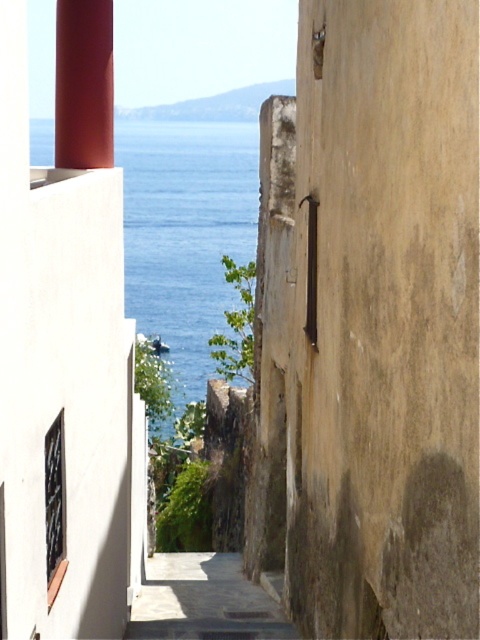
Question: Which of the following is the farthest from the observer?

Choices:
 (A) (287, 234)
 (B) (187, 218)

Answer: (B)

Question: Can you confirm if smooth concrete pillar at center is wider than blue water at center?

Choices:
 (A) yes
 (B) no

Answer: (B)

Question: Does smooth concrete pillar at center have a larger size compared to blue water at center?

Choices:
 (A) yes
 (B) no

Answer: (B)

Question: In this image, where is smooth concrete pillar at center located relative to blue water at center?

Choices:
 (A) right
 (B) left

Answer: (A)